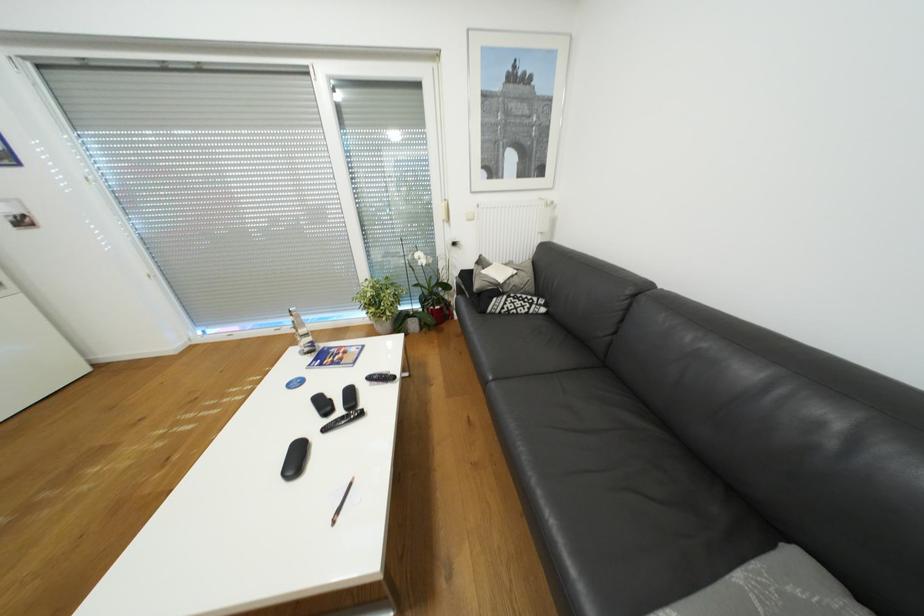
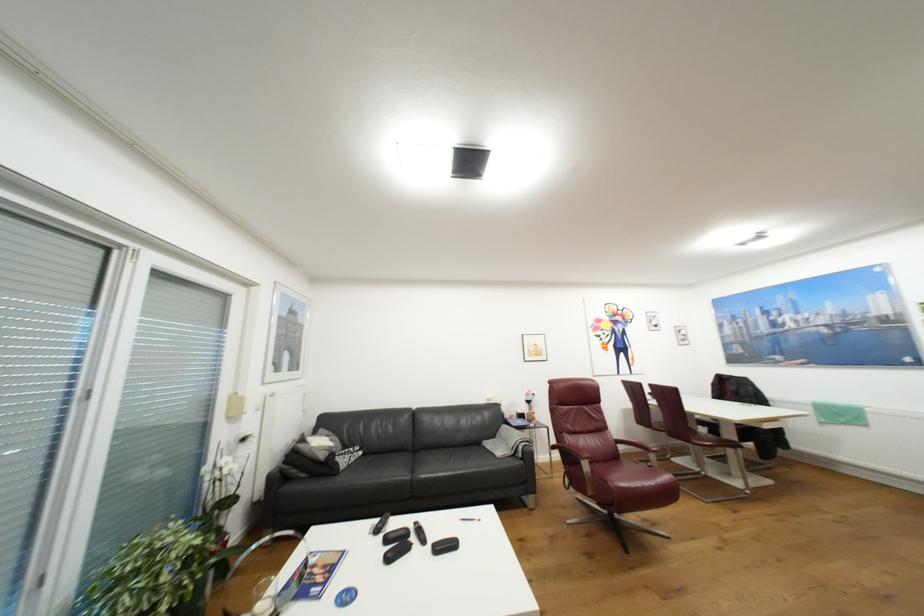
Where in the second image is the point corresponding to (x=488, y=262) from the first image?

(309, 440)